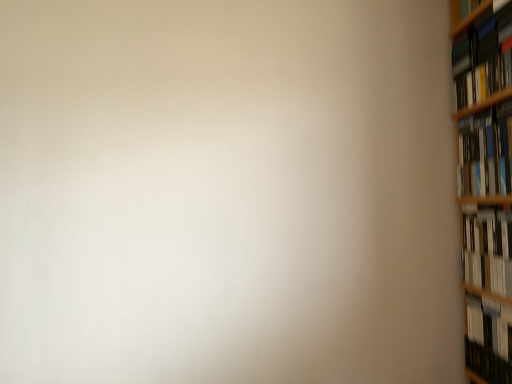
Question: Is hardcover book at upper right, marked as the first book in a top-to-bottom arrangement, looking in the opposite direction of hardcover book at right, the 2th book when ordered from top to bottom?

Choices:
 (A) no
 (B) yes

Answer: (A)

Question: From a real-world perspective, is hardcover book at upper right, marked as the first book in a top-to-bottom arrangement, on top of hardcover book at right, the 2th book when ordered from top to bottom?

Choices:
 (A) yes
 (B) no

Answer: (A)

Question: Is hardcover book at upper right, marked as the first book in a top-to-bottom arrangement, behind hardcover book at right, the 2th book when ordered from top to bottom?

Choices:
 (A) no
 (B) yes

Answer: (A)

Question: Is hardcover book at upper right, marked as the first book in a top-to-bottom arrangement, far away from hardcover book at right, the 2th book when ordered from top to bottom?

Choices:
 (A) yes
 (B) no

Answer: (B)

Question: From a real-world perspective, is hardcover book at upper right, marked as the first book in a top-to-bottom arrangement, beneath hardcover book at right, the third book positioned from the bottom?

Choices:
 (A) no
 (B) yes

Answer: (A)

Question: In terms of height, does white glossy book at right, acting as the 3th book starting from the top, look taller or shorter compared to hardcover book at right, the third book positioned from the bottom?

Choices:
 (A) tall
 (B) short

Answer: (A)

Question: Is point (480, 238) closer or farther from the camera than point (498, 147)?

Choices:
 (A) farther
 (B) closer

Answer: (A)

Question: Visually, is white glossy book at right, acting as the 3th book starting from the top, positioned to the left or to the right of hardcover book at right, the third book positioned from the bottom?

Choices:
 (A) left
 (B) right

Answer: (B)

Question: From a real-world perspective, is white glossy book at right, acting as the 3th book starting from the top, physically located above or below hardcover book at right, the 2th book when ordered from top to bottom?

Choices:
 (A) below
 (B) above

Answer: (A)

Question: Is hardcover book at right, the fourth book from the top, inside or outside of hardcover book at right, the 2th book when ordered from top to bottom?

Choices:
 (A) outside
 (B) inside

Answer: (A)

Question: Considering their positions, is hardcover book at right, which appears as the 1th book when ordered from the bottom, located in front of or behind hardcover book at right, the 2th book when ordered from top to bottom?

Choices:
 (A) front
 (B) behind

Answer: (B)

Question: In terms of height, does hardcover book at right, which appears as the 1th book when ordered from the bottom, look taller or shorter compared to hardcover book at right, the third book positioned from the bottom?

Choices:
 (A) tall
 (B) short

Answer: (B)

Question: Based on their positions, is hardcover book at right, which appears as the 1th book when ordered from the bottom, located to the left or right of hardcover book at right, the 2th book when ordered from top to bottom?

Choices:
 (A) right
 (B) left

Answer: (A)

Question: From a real-world perspective, is hardcover book at right, the third book positioned from the bottom, positioned above or below hardcover book at right, the fourth book from the top?

Choices:
 (A) above
 (B) below

Answer: (A)

Question: Is hardcover book at right, the third book positioned from the bottom, situated inside hardcover book at right, which appears as the 1th book when ordered from the bottom, or outside?

Choices:
 (A) inside
 (B) outside

Answer: (B)